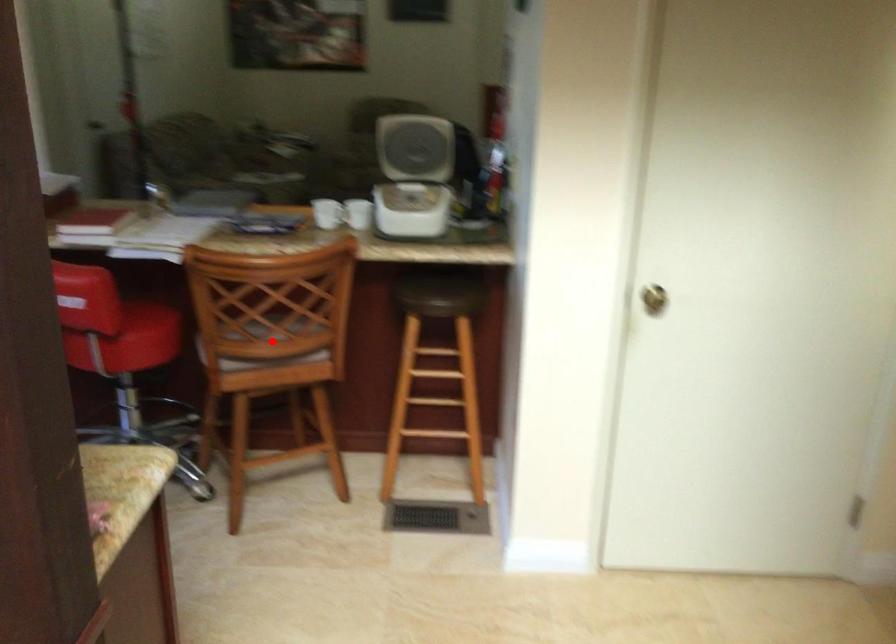
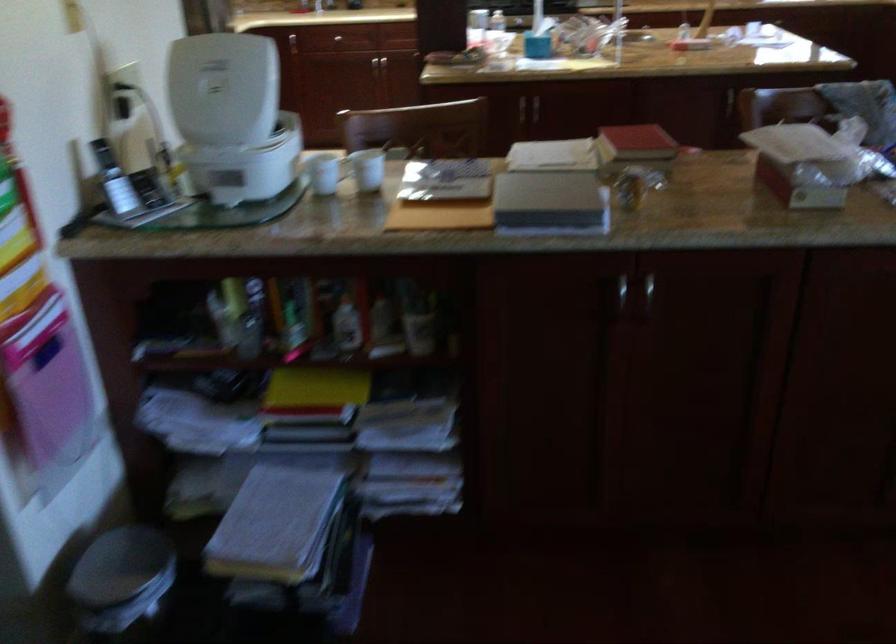
Question: I am providing you with two images of the same scene from different viewpoints. A red point is marked on the first image. At the location where the point appears in image 1, is it still visible in image 2?

Choices:
 (A) Yes
 (B) No

Answer: (B)